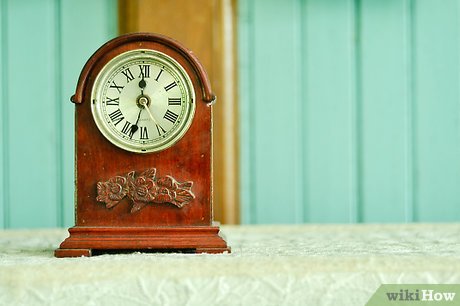
This screenshot has width=460, height=306. In order to click on gold trim around clock face in this screenshot , I will do `click(177, 134)`.